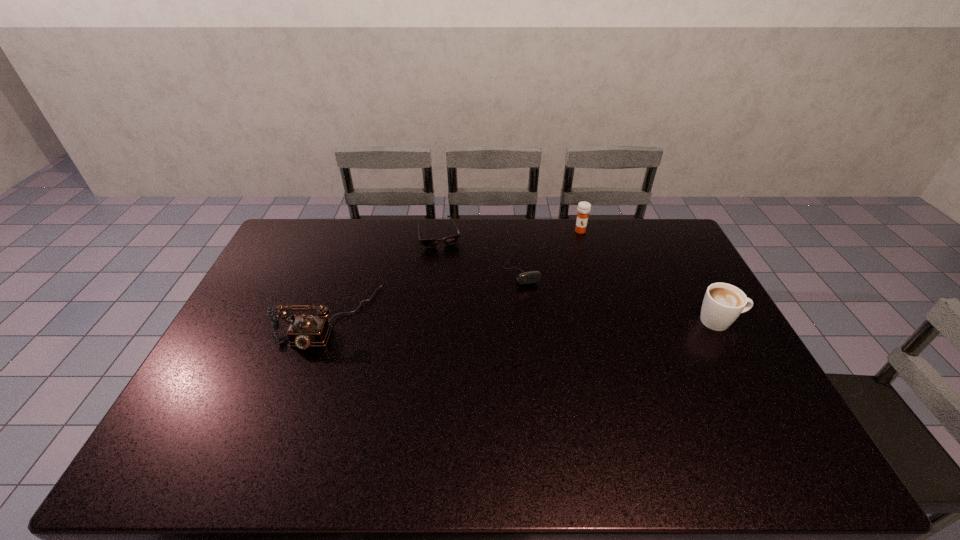
The image size is (960, 540). Identify the location of vacant area situated on the front-facing side of the webcam. (562, 370).

Locate an element on the screen. vacant space positioned 0.200m on the label side of the fourth object from left to right is located at coordinates (578, 267).

What are the coordinates of `vacant space situated on the label side of the fourth object from left to right` in the screenshot? It's located at (575, 306).

You are a GUI agent. You are given a task and a screenshot of the screen. Output one action in this format:
    pyautogui.click(x=<x>, y=<y>)
    Task: Click on the vacant space located on the label side of the fourth object from left to right
    
    Given the screenshot: What is the action you would take?
    pyautogui.click(x=578, y=268)

Locate an element on the screen. vacant region located 0.170m on the front-facing side of the sunglasses is located at coordinates (452, 279).

This screenshot has height=540, width=960. In order to click on vacant region located on the front-facing side of the sunglasses in this screenshot , I will do `click(454, 285)`.

At what (x,y) coordinates should I click in order to perform the action: click on vacant region located on the front-facing side of the sunglasses. Please return your answer as a coordinate pair (x, y). The width and height of the screenshot is (960, 540). Looking at the image, I should click on (x=462, y=309).

The width and height of the screenshot is (960, 540). Identify the location of webcam at the far edge. (531, 277).

At what (x,y) coordinates should I click in order to perform the action: click on medicine present at the far edge. Please return your answer as a coordinate pair (x, y). This screenshot has height=540, width=960. Looking at the image, I should click on (584, 208).

The height and width of the screenshot is (540, 960). In order to click on sunglasses that is at the far edge in this screenshot , I will do tap(432, 242).